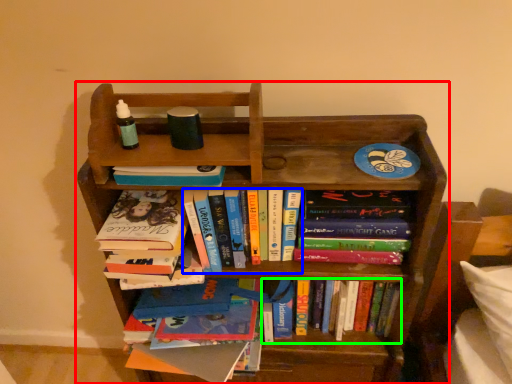
Question: Based on their relative distances, which object is nearer to bookcase (highlighted by a red box)? Choose from book (highlighted by a blue box) and book (highlighted by a green box).

Choices:
 (A) book
 (B) book

Answer: (A)